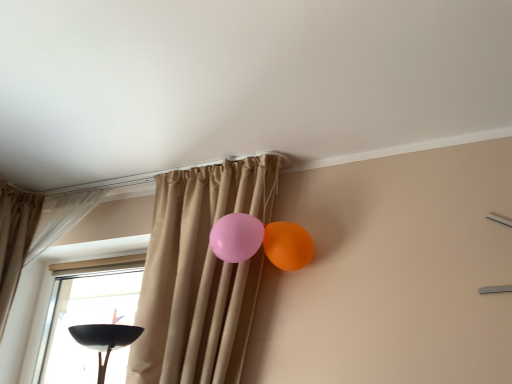
Question: Is orange glossy balloon at upper right bigger or smaller than beige fabric curtain at upper left, the 1th curtain positioned from the left?

Choices:
 (A) big
 (B) small

Answer: (B)

Question: From a real-world perspective, is orange glossy balloon at upper right positioned above or below beige fabric curtain at upper left, which appears as the 2th curtain when viewed from the right?

Choices:
 (A) above
 (B) below

Answer: (B)

Question: Which object is positioned closest to the orange glossy balloon at upper right?

Choices:
 (A) beige fabric curtain at center, marked as the second curtain in a left-to-right arrangement
 (B) beige fabric curtain at upper left, which appears as the 2th curtain when viewed from the right

Answer: (A)

Question: Estimate the real-world distances between objects in this image. Which object is farther from the beige fabric curtain at center, marked as the second curtain in a left-to-right arrangement?

Choices:
 (A) beige fabric curtain at upper left, the 1th curtain positioned from the left
 (B) orange glossy balloon at upper right

Answer: (A)